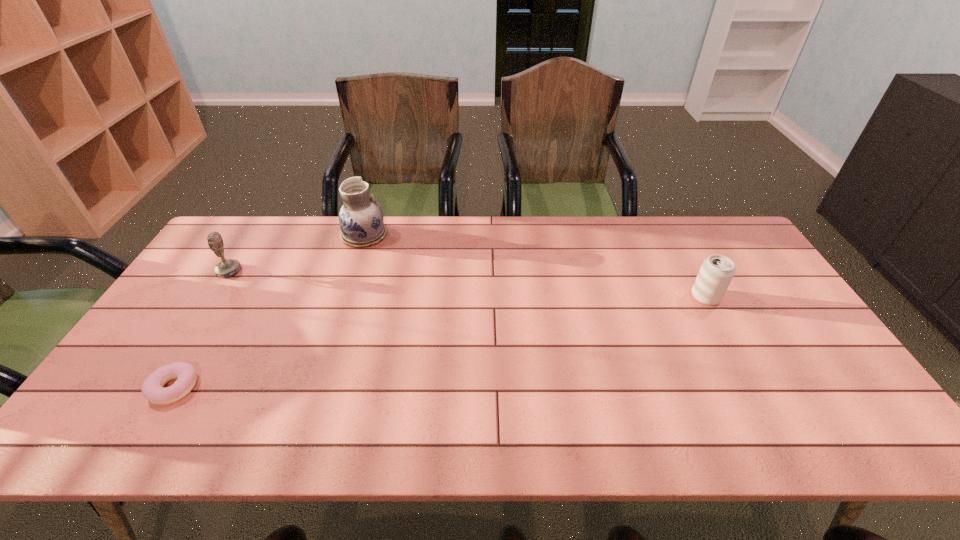
This screenshot has width=960, height=540. I want to click on free location located on the right of the nearest object, so click(x=226, y=388).

This screenshot has height=540, width=960. In order to click on object situated at the far edge in this screenshot , I will do coord(361,222).

Where is `microphone located in the left edge section of the desktop`? This screenshot has height=540, width=960. microphone located in the left edge section of the desktop is located at coordinates (226, 268).

Where is `doughnut at the left edge`? The height and width of the screenshot is (540, 960). doughnut at the left edge is located at coordinates (152, 388).

Locate an element on the screen. The image size is (960, 540). free space at the far edge of the desktop is located at coordinates (697, 256).

Find the location of a particular element. The width and height of the screenshot is (960, 540). free region at the near edge is located at coordinates pyautogui.click(x=795, y=434).

The height and width of the screenshot is (540, 960). I want to click on vacant space at the right edge, so click(786, 313).

In the image, there is a desktop. Identify the location of vacant space at the far left corner. Image resolution: width=960 pixels, height=540 pixels. (260, 252).

This screenshot has width=960, height=540. Identify the location of free space at the far right corner. (729, 231).

The image size is (960, 540). Identify the location of free spot at the near right corner of the desktop. (818, 427).